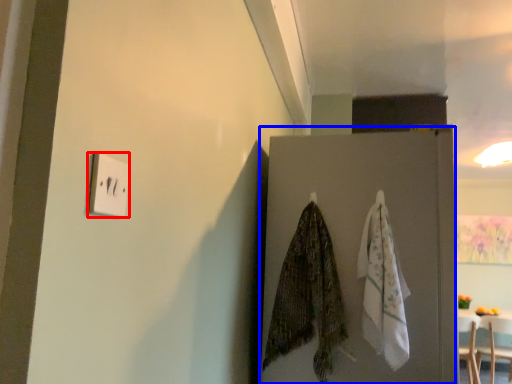
Question: Which point is closer to the camera, light switch (highlighted by a red box) or door (highlighted by a blue box)?

Choices:
 (A) light switch
 (B) door

Answer: (A)